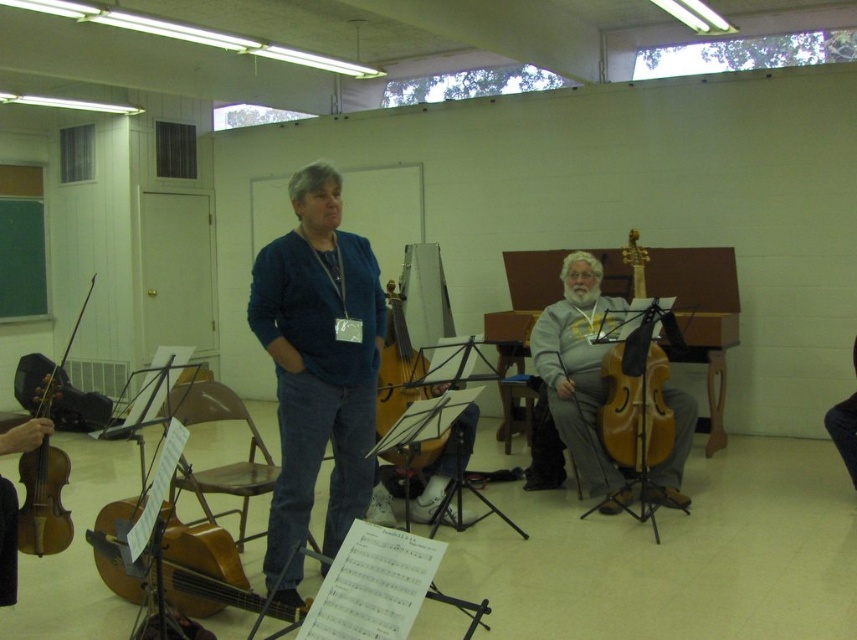
You are a photographer setting up for a group photo. You see two violins in the scene, the wooden violin at center and the wooden violin at left. Which violin should you move to the right to create space for a new microphone stand that needs to be placed between them?

You should move the wooden violin at left to the right because the wooden violin at center is already positioned on the right side of the wooden violin at left, so shifting the left one further right would create space between them for the microphone stand.

You are a music teacher setting up for a class and need to arrange the wooden violin at center and the wooden violin at left on a shelf. If the shelf has limited vertical space, which violin should you place first to ensure both fit?

The wooden violin at left should be placed first since the wooden violin at center is taller and requires more vertical space to fit both on the shelf.